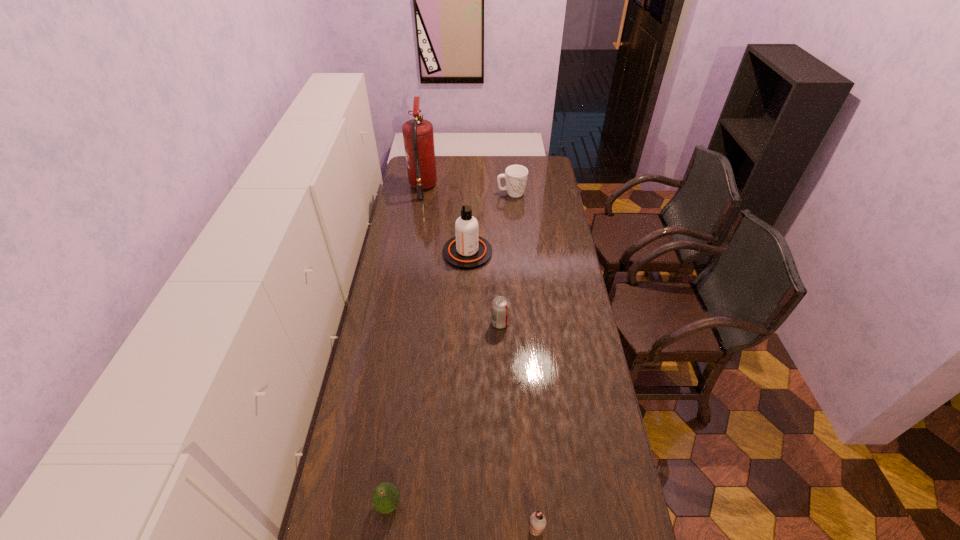
Locate an element on the screen. Image resolution: width=960 pixels, height=540 pixels. free spot between the fifth shortest object and the mug is located at coordinates (490, 223).

Select which object appears as the fourth closest to the nearest object. Please provide its 2D coordinates. Your answer should be formatted as a tuple, i.e. [(x, y)], where the tuple contains the x and y coordinates of a point satisfying the conditions above.

[(516, 176)]

Where is `object that stands as the closest to the third farthest object`? object that stands as the closest to the third farthest object is located at coordinates (500, 307).

Locate an element on the screen. The height and width of the screenshot is (540, 960). blank area in the image that satisfies the following two spatial constraints: 1. at the front of the avocado where the nozzle is aimed; 2. on the right side of the tallest object is located at coordinates (372, 504).

Locate an element on the screen. free space that satisfies the following two spatial constraints: 1. at the front of the chocolate milk where the nozzle is aimed; 2. on the left side of the tallest object is located at coordinates (368, 529).

Identify the location of free space in the image that satisfies the following two spatial constraints: 1. at the front of the tallest object where the nozzle is aimed; 2. on the left side of the chocolate milk. The width and height of the screenshot is (960, 540). (368, 529).

Identify the location of free space in the image that satisfies the following two spatial constraints: 1. at the front of the cleansing agent where the nozzle is aimed; 2. on the right side of the fire extinguisher. (413, 253).

Identify the location of vacant region that satisfies the following two spatial constraints: 1. at the front of the tallest object where the nozzle is aimed; 2. on the left side of the chocolate milk. click(368, 529).

Identify the location of vacant space that satisfies the following two spatial constraints: 1. on the side of the mug with the handle; 2. on the front side of the nearest object. This screenshot has height=540, width=960. (540, 529).